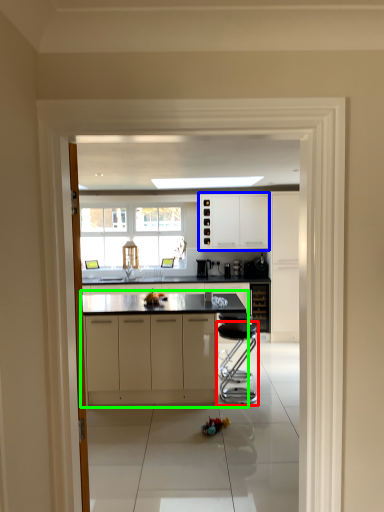
Question: Which object is positioned closest to bar stool (highlighted by a red box)? Select from cabinetry (highlighted by a blue box) and cabinetry (highlighted by a green box).

Choices:
 (A) cabinetry
 (B) cabinetry

Answer: (B)